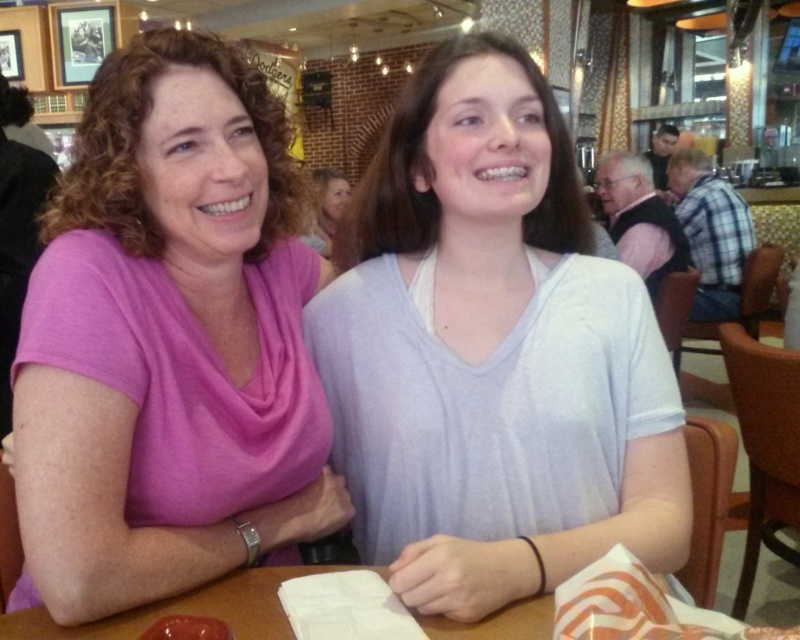
Question: Does white matte shirt at center appear under wooden table at center?

Choices:
 (A) yes
 (B) no

Answer: (B)

Question: Does pink soft fabric shirt at left have a smaller size compared to blonde hair at upper center?

Choices:
 (A) yes
 (B) no

Answer: (A)

Question: Considering the relative positions of white matte shirt at center and matte red apple at lower left in the image provided, where is white matte shirt at center located with respect to matte red apple at lower left?

Choices:
 (A) above
 (B) below

Answer: (A)

Question: Which object is farther from the camera taking this photo?

Choices:
 (A) blonde hair at upper center
 (B) white matte shirt at center
 (C) wooden table at center
 (D) matte red apple at lower left

Answer: (A)

Question: Which object is the closest to the white matte shirt at center?

Choices:
 (A) blonde hair at upper center
 (B) matte red apple at lower left
 (C) wooden table at center
 (D) pink soft fabric shirt at left

Answer: (D)

Question: Which of the following is the farthest from the observer?

Choices:
 (A) pink soft fabric shirt at left
 (B) blonde hair at upper center
 (C) wooden table at center
 (D) matte red apple at lower left

Answer: (B)